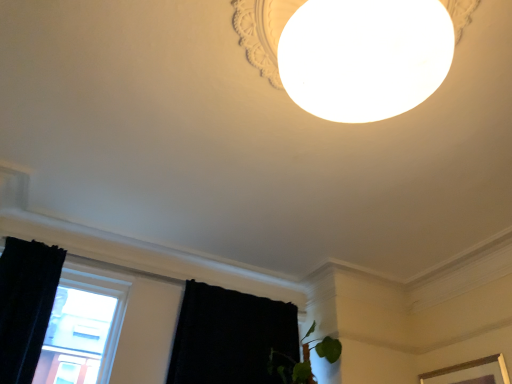
Question: Can you confirm if black velvet curtain at left, which ranks as the second curtain in right-to-left order, is thinner than transparent glass window at lower left?

Choices:
 (A) no
 (B) yes

Answer: (A)

Question: From a real-world perspective, does black velvet curtain at left, which ranks as the second curtain in right-to-left order, sit lower than transparent glass window at lower left?

Choices:
 (A) no
 (B) yes

Answer: (A)

Question: Does black velvet curtain at left, which ranks as the second curtain in right-to-left order, have a lesser height compared to transparent glass window at lower left?

Choices:
 (A) yes
 (B) no

Answer: (B)

Question: Is black velvet curtain at left, which ranks as the second curtain in right-to-left order, aimed at transparent glass window at lower left?

Choices:
 (A) no
 (B) yes

Answer: (B)

Question: Is black velvet curtain at left, the first curtain from the left, located outside transparent glass window at lower left?

Choices:
 (A) yes
 (B) no

Answer: (A)

Question: From the image's perspective, is black velvet curtain at left, the first curtain from the left, over transparent glass window at lower left?

Choices:
 (A) yes
 (B) no

Answer: (A)

Question: Is black fabric curtain at lower left, the 1th curtain when ordered from right to left, aimed at transparent glass window at lower left?

Choices:
 (A) no
 (B) yes

Answer: (A)

Question: Does black fabric curtain at lower left, the 1th curtain when ordered from right to left, have a smaller size compared to transparent glass window at lower left?

Choices:
 (A) yes
 (B) no

Answer: (B)

Question: Is transparent glass window at lower left a part of black fabric curtain at lower left, the second curtain positioned from the left?

Choices:
 (A) yes
 (B) no

Answer: (B)

Question: Can you confirm if black fabric curtain at lower left, the 1th curtain when ordered from right to left, is bigger than transparent glass window at lower left?

Choices:
 (A) no
 (B) yes

Answer: (B)

Question: Is black fabric curtain at lower left, the 1th curtain when ordered from right to left, facing away from transparent glass window at lower left?

Choices:
 (A) yes
 (B) no

Answer: (B)

Question: From the image's perspective, is black fabric curtain at lower left, the 1th curtain when ordered from right to left, on black velvet curtain at left, which ranks as the second curtain in right-to-left order?

Choices:
 (A) yes
 (B) no

Answer: (B)